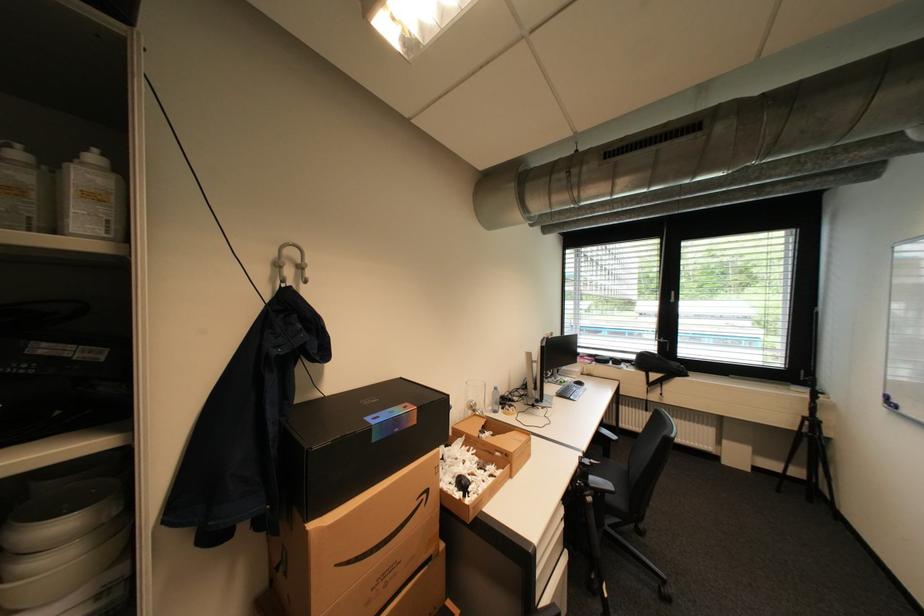
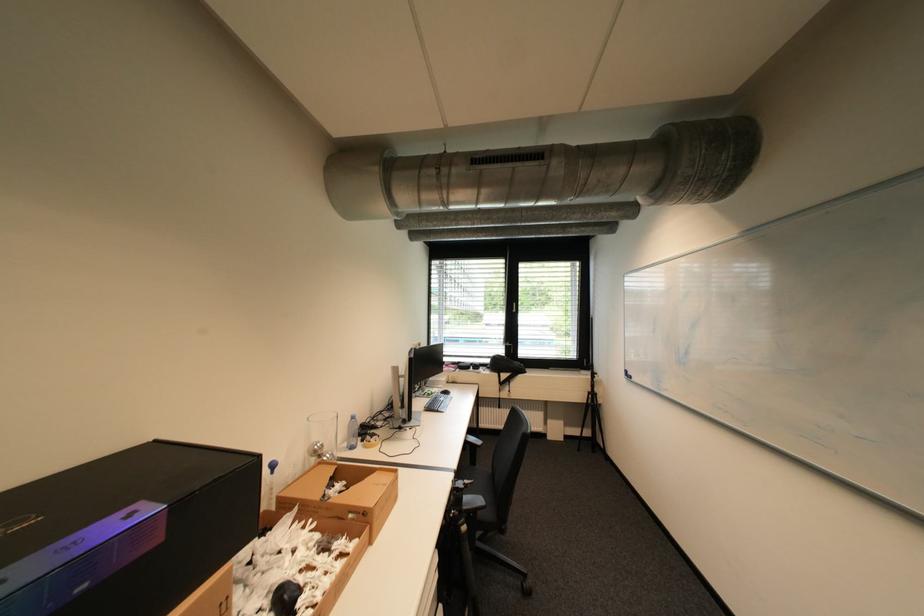
Question: The images are taken continuously from a first-person perspective. In which direction is your viewpoint rotating?

Choices:
 (A) Left
 (B) Right
 (C) Up
 (D) Down

Answer: (B)